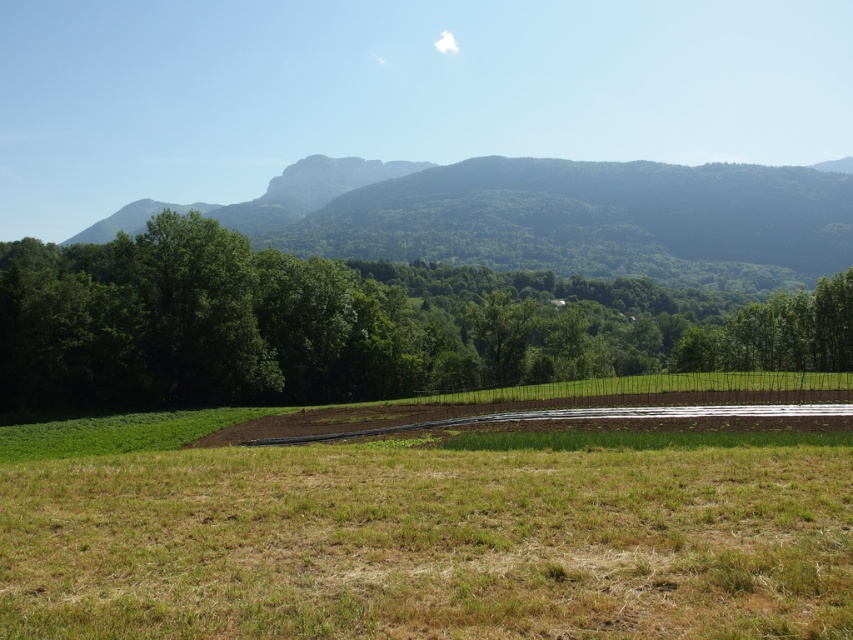
Is point (96, 490) closer to camera compared to point (277, 282)?

That is True.

Does dry grass at center come behind green leafy tree at center?

No, dry grass at center is in front of green leafy tree at center.

Find the location of `dry grass at center`. dry grass at center is located at coordinates (428, 544).